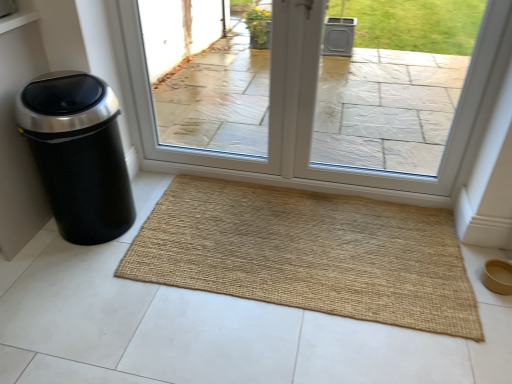
The image size is (512, 384). Find the location of `vacant area on top of natural fiber mat at center (from a real-world perspective)`. vacant area on top of natural fiber mat at center (from a real-world perspective) is located at coordinates (292, 240).